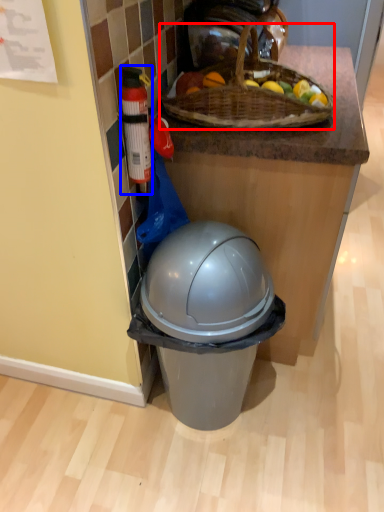
Question: Which of the following is the farthest to the observer, picnic basket (highlighted by a red box) or bottle (highlighted by a blue box)?

Choices:
 (A) picnic basket
 (B) bottle

Answer: (A)